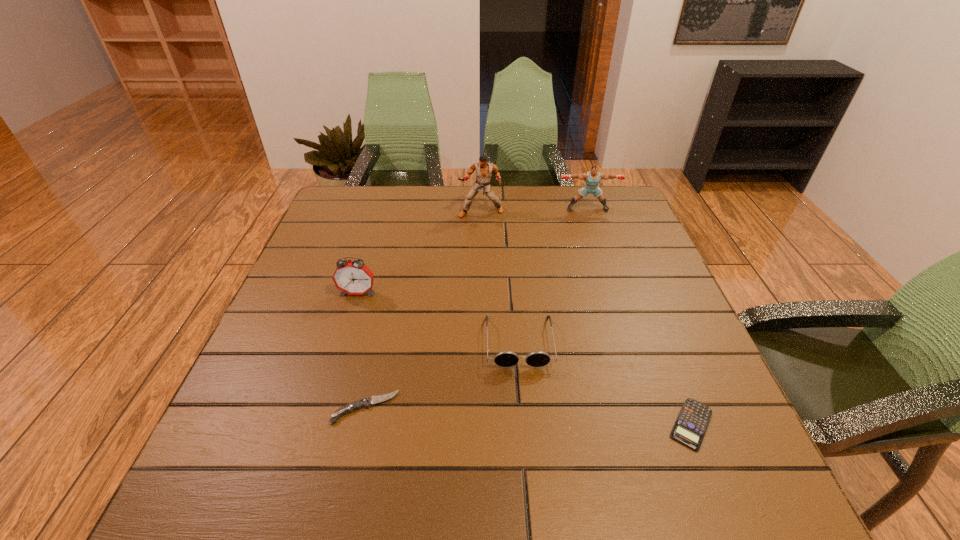
At what (x,y) coordinates should I click in order to perform the action: click on free region at the far edge of the desktop. Please return your answer as a coordinate pair (x, y). Looking at the image, I should click on (456, 192).

Locate an element on the screen. This screenshot has width=960, height=540. vacant space at the near edge of the desktop is located at coordinates (524, 468).

Locate an element on the screen. The width and height of the screenshot is (960, 540). free region at the left edge of the desktop is located at coordinates (312, 269).

I want to click on free space at the right edge of the desktop, so click(x=684, y=353).

What are the coordinates of `vacant space at the far right corner` in the screenshot? It's located at (636, 213).

Locate an element on the screen. free space at the near right corner of the desktop is located at coordinates (750, 475).

Find the location of a particular element. The width and height of the screenshot is (960, 540). vacant space that is in between the right puncher and the fourth tallest object is located at coordinates (553, 275).

Where is `free space between the taller puncher and the fourth nearest object`? This screenshot has height=540, width=960. free space between the taller puncher and the fourth nearest object is located at coordinates (420, 253).

What are the coordinates of `free spot between the pocketknife and the second tallest object` in the screenshot? It's located at (476, 308).

You are a GUI agent. You are given a task and a screenshot of the screen. Output one action in this format:
    pyautogui.click(x=<x>, y=<y>)
    Task: Click on the free space between the pocketknife and the third tallest object
    The height and width of the screenshot is (540, 960).
    Given the screenshot: What is the action you would take?
    pyautogui.click(x=362, y=350)